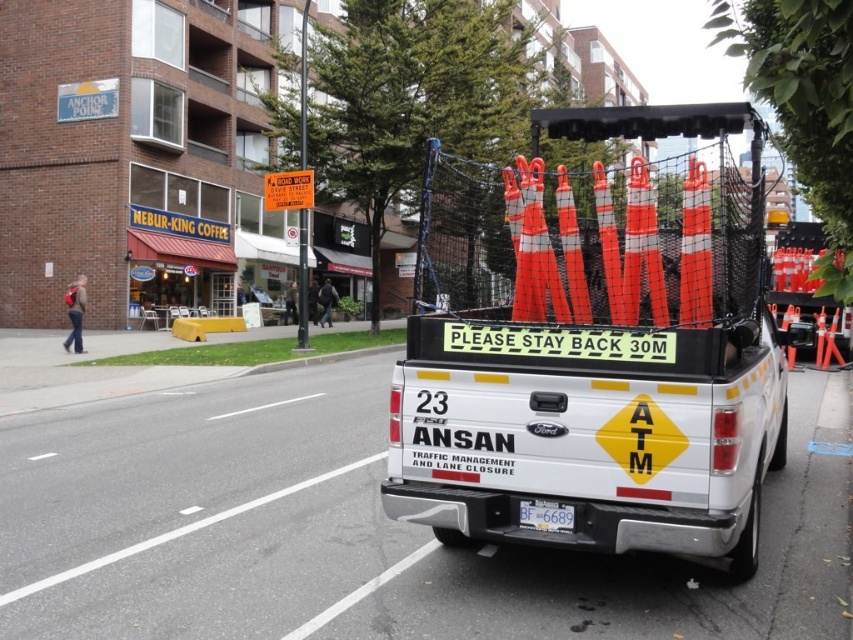
Does orange reflective traffic cones at rear appear over white plastic license plate at center?

Yes.

Is orange reflective traffic cones at rear behind white plastic license plate at center?

No.

Is point (514, 474) more distant than point (570, 529)?

Yes, it is behind point (570, 529).

In order to click on orange reflective traffic cones at rear in this screenshot , I will do `click(595, 348)`.